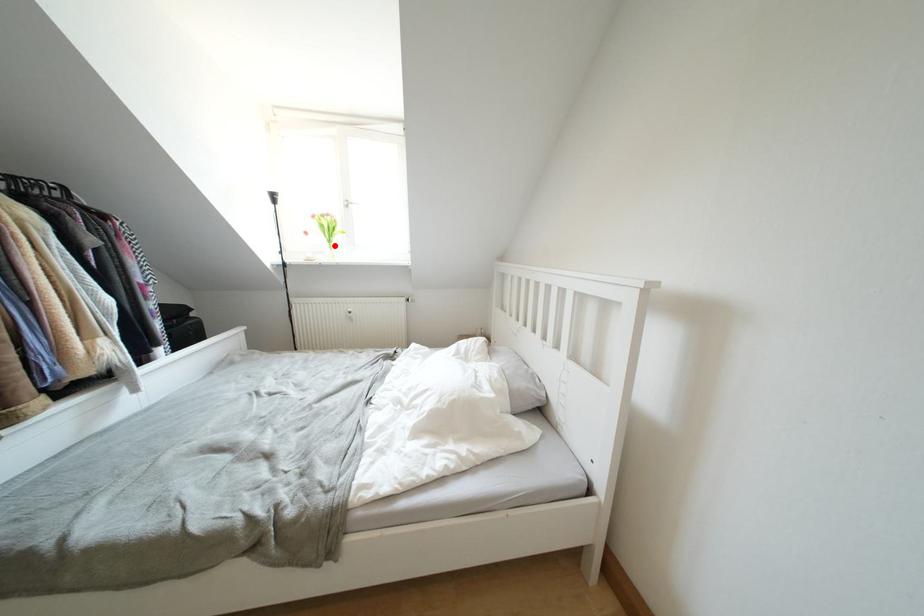
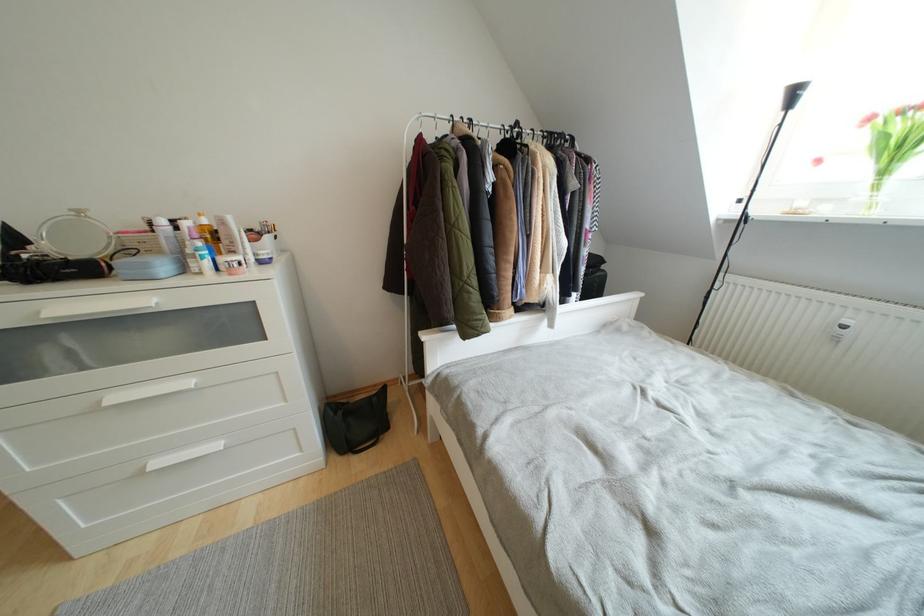
Question: A red point is marked in image1. In image2, is the corresponding 3D point closer to the camera or farther? Reply with the corresponding letter.

Choices:
 (A) The corresponding 3D point is closer.
 (B) The corresponding 3D point is farther.

Answer: (B)